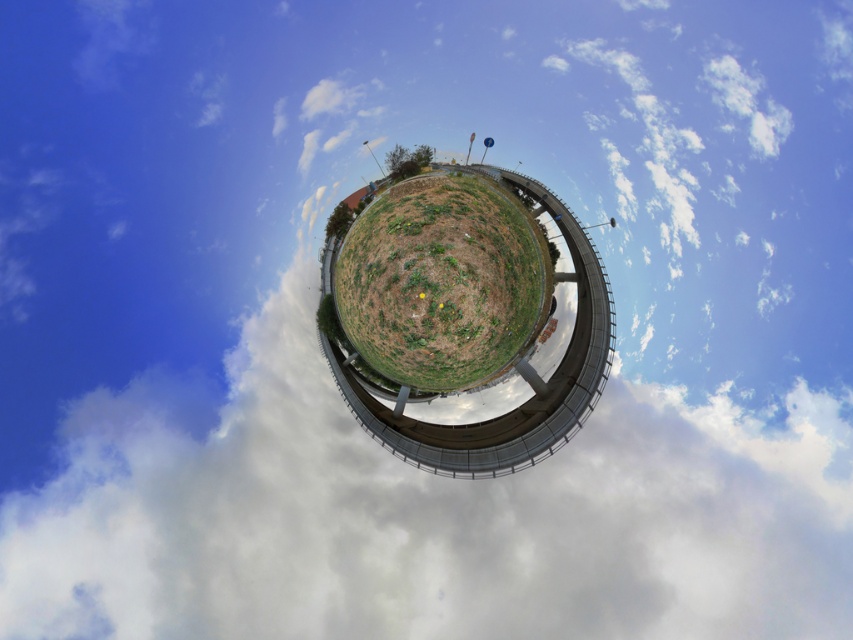
In the scene shown: Does green matte grass at center appear over green leafy tree at upper center?

Incorrect, green matte grass at center is not positioned above green leafy tree at upper center.

Which is more to the right, green matte grass at center or green leafy tree at upper center?

green matte grass at center

Is point (440, 241) positioned before point (425, 161)?

That is False.

Locate an element on the screen. green matte grass at center is located at coordinates (440, 284).

Is green leafy tree at upper center positioned at the back of green leafy tree at center?

No, green leafy tree at upper center is in front of green leafy tree at center.

Which is more to the right, green leafy tree at upper center or green leafy tree at center?

green leafy tree at upper center is more to the right.

Between point (393, 156) and point (341, 232), which one is positioned behind?

Point (393, 156)

Image resolution: width=853 pixels, height=640 pixels. Identify the location of green leafy tree at upper center. (405, 161).

Between green matte grass at center and green leafy tree at center, which one has less height?

green leafy tree at center is shorter.

Does green matte grass at center appear over green leafy tree at center?

Actually, green matte grass at center is below green leafy tree at center.

Does point (340, 276) lie behind point (326, 225)?

Yes, it is behind point (326, 225).

Find the location of a particular element. Image resolution: width=853 pixels, height=640 pixels. green matte grass at center is located at coordinates (440, 284).